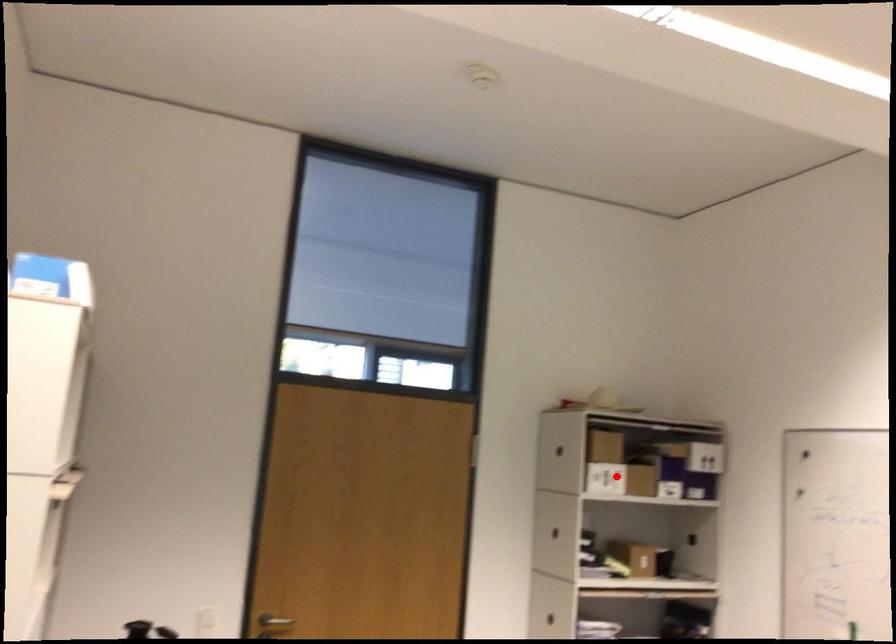
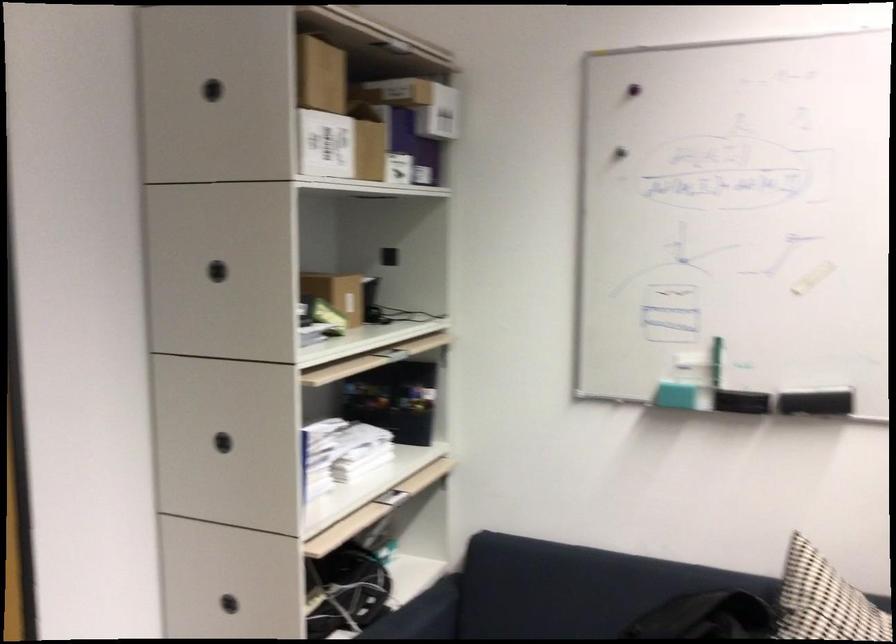
Question: A red point is marked in image1. In image2, is the corresponding 3D point closer to the camera or farther? Reply with the corresponding letter.

Choices:
 (A) The corresponding 3D point is closer.
 (B) The corresponding 3D point is farther.

Answer: (A)